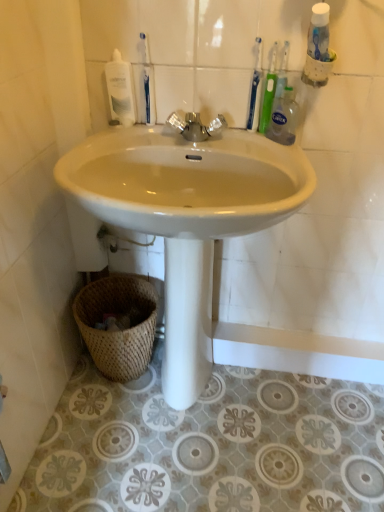
The image size is (384, 512). I want to click on vacant space to the left of silver metallic faucet at center, so click(x=125, y=137).